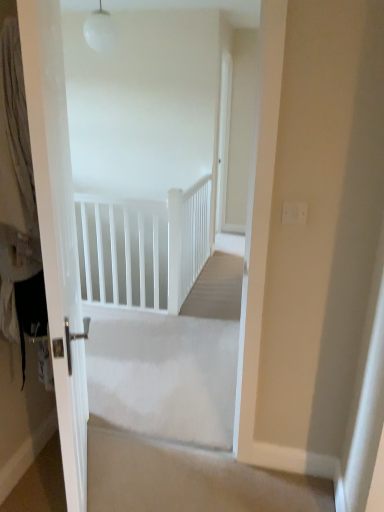
Identify the location of vacant area on top of beige carpet at center (from a real-world perspective). (165, 471).